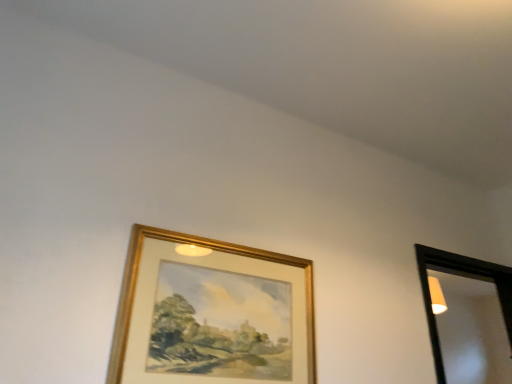
What do you see at coordinates (211, 313) in the screenshot? I see `gold metallic picture frame at center` at bounding box center [211, 313].

This screenshot has height=384, width=512. What are the coordinates of `gold metallic picture frame at center` in the screenshot? It's located at (211, 313).

Find the location of `gold metallic picture frame at center`. gold metallic picture frame at center is located at coordinates (211, 313).